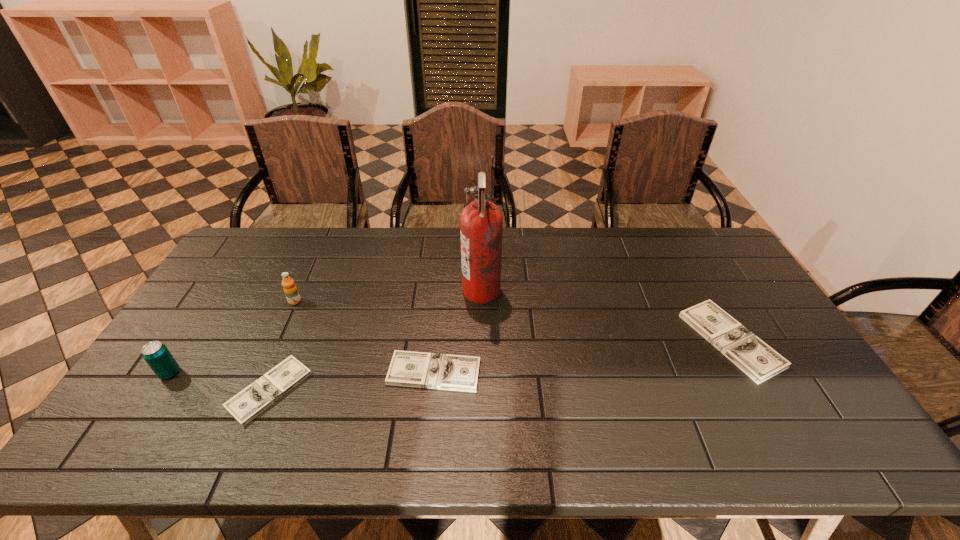
This screenshot has height=540, width=960. I want to click on free location that satisfies the following two spatial constraints: 1. on the back side of the second shortest object; 2. on the left side of the shortest dollar, so click(x=277, y=373).

Identify the location of free space that satisfies the following two spatial constraints: 1. on the label of the rightmost dollar; 2. on the left side of the orange juice. This screenshot has height=540, width=960. (277, 340).